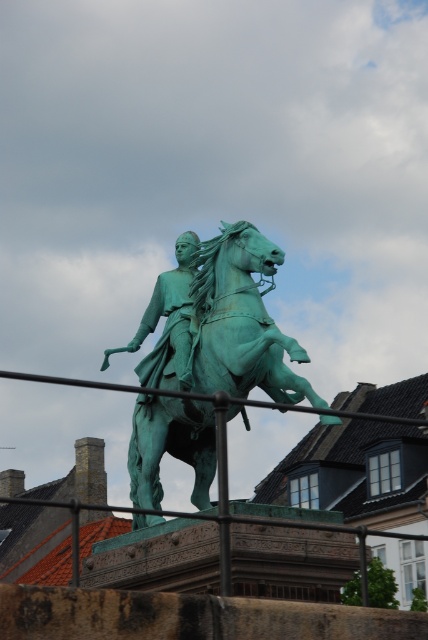
Question: In this image, where is green patinated bronze statue at center located relative to green patinated statue at center?

Choices:
 (A) below
 (B) above

Answer: (A)

Question: Can you confirm if green patinated bronze statue at center is thinner than rustic metal fence at center?

Choices:
 (A) yes
 (B) no

Answer: (A)

Question: Considering the real-world distances, which object is farthest from the green patinated statue at center?

Choices:
 (A) rustic metal fence at center
 (B) green patinated bronze statue at center

Answer: (A)

Question: Considering the real-world distances, which object is farthest from the green patinated bronze statue at center?

Choices:
 (A) green patinated statue at center
 (B) rustic metal fence at center

Answer: (B)

Question: Can you confirm if green patinated bronze statue at center is positioned to the left of green patinated statue at center?

Choices:
 (A) yes
 (B) no

Answer: (B)

Question: Which object appears farthest from the camera in this image?

Choices:
 (A) green patinated statue at center
 (B) green patinated bronze statue at center

Answer: (A)